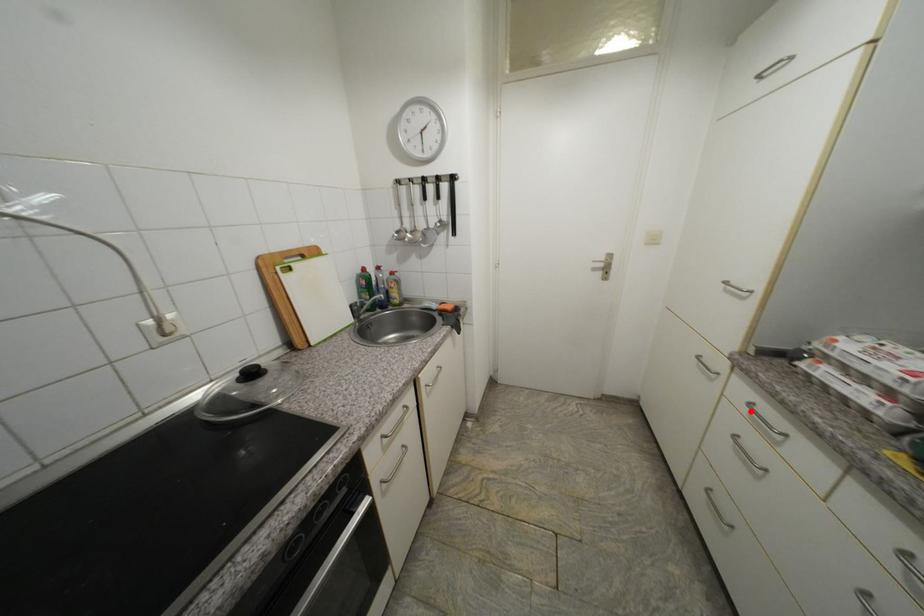
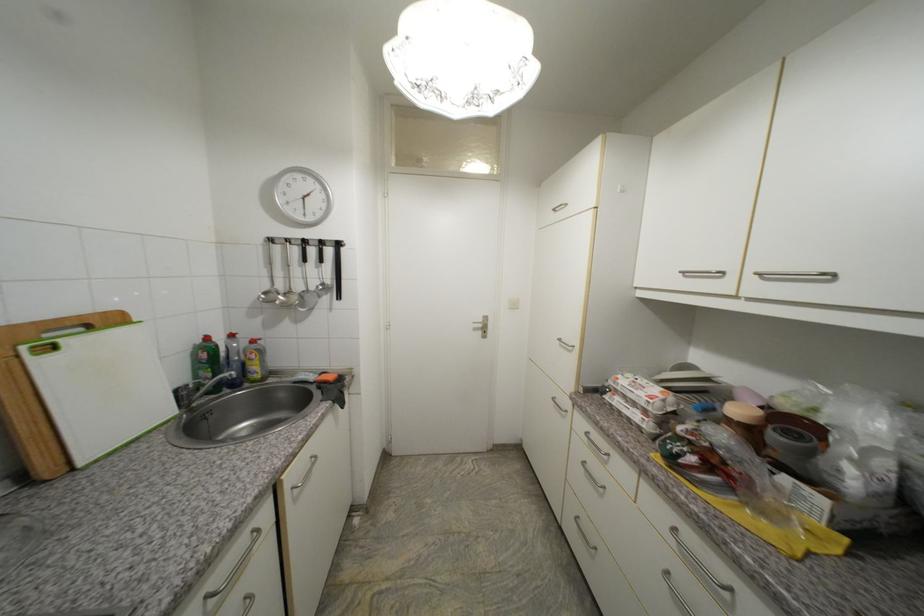
The point at the highlighted location is marked in the first image. Where is the corresponding point in the second image?

(590, 440)